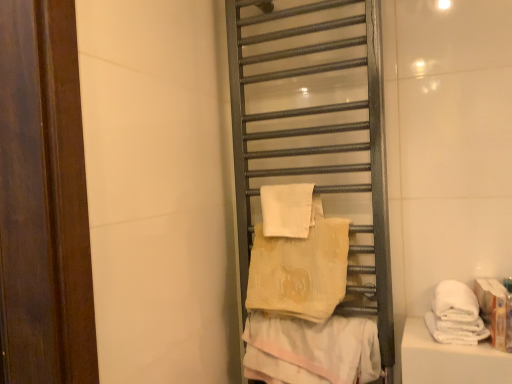
Question: Based on their sizes in the image, would you say white soft towel at center, acting as the fourth towel starting from the bottom, is bigger or smaller than beige textured towel at center, arranged as the 1th towel when ordered from the bottom?

Choices:
 (A) small
 (B) big

Answer: (A)

Question: Looking at their shapes, would you say white soft towel at center, acting as the fourth towel starting from the bottom, is wider or thinner than beige textured towel at center, arranged as the 1th towel when ordered from the bottom?

Choices:
 (A) thin
 (B) wide

Answer: (A)

Question: Considering the real-world distances, which object is closest to the beige soft towel at center, acting as the second towel starting from the top?

Choices:
 (A) white soft towel at center, arranged as the first towel when viewed from the top
 (B) white soft towel at right, arranged as the second towel when ordered from the bottom
 (C) beige textured towel at center, the 4th towel viewed from the top
 (D) metallic towel rack at center

Answer: (A)

Question: Which is farther from the metallic towel rack at center?

Choices:
 (A) beige textured towel at center, the 4th towel viewed from the top
 (B) white soft towel at center, acting as the fourth towel starting from the bottom
 (C) beige soft towel at center, acting as the second towel starting from the top
 (D) white soft towel at right, which appears as the third towel when viewed from the top

Answer: (D)